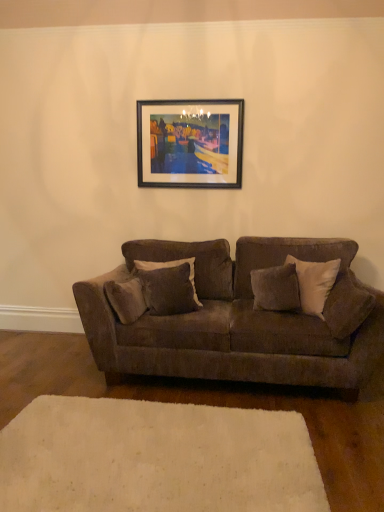
Question: Could white soft rug at lower center be considered to be inside velvet gray pillow at center, which is the third pillow from right to left?

Choices:
 (A) yes
 (B) no

Answer: (B)

Question: Can you confirm if velvet gray pillow at center, which is the third pillow from right to left, is positioned to the right of white soft rug at lower center?

Choices:
 (A) no
 (B) yes

Answer: (B)

Question: Considering the relative sizes of velvet gray pillow at center, the first pillow positioned from the left, and white soft rug at lower center in the image provided, is velvet gray pillow at center, the first pillow positioned from the left, thinner than white soft rug at lower center?

Choices:
 (A) yes
 (B) no

Answer: (A)

Question: Is the position of velvet gray pillow at center, the first pillow positioned from the left, more distant than that of white soft rug at lower center?

Choices:
 (A) no
 (B) yes

Answer: (B)

Question: Is velvet gray pillow at center, which is the third pillow from right to left, smaller than white soft rug at lower center?

Choices:
 (A) no
 (B) yes

Answer: (B)

Question: Is velvet gray pillow at center, which is the third pillow from right to left, closer to camera compared to white soft rug at lower center?

Choices:
 (A) no
 (B) yes

Answer: (A)

Question: Is soft gray fabric pillow at right, which is the first pillow in right-to-left order, wider than velvet brown couch at center?

Choices:
 (A) no
 (B) yes

Answer: (A)

Question: Does soft gray fabric pillow at right, the 3th pillow in the left-to-right sequence, come behind velvet brown couch at center?

Choices:
 (A) yes
 (B) no

Answer: (B)

Question: Is soft gray fabric pillow at right, the 3th pillow in the left-to-right sequence, far away from velvet brown couch at center?

Choices:
 (A) yes
 (B) no

Answer: (B)

Question: Is velvet brown couch at center inside soft gray fabric pillow at right, the 3th pillow in the left-to-right sequence?

Choices:
 (A) no
 (B) yes

Answer: (A)

Question: From the image's perspective, is soft gray fabric pillow at right, which is the first pillow in right-to-left order, beneath velvet brown couch at center?

Choices:
 (A) no
 (B) yes

Answer: (A)

Question: From a real-world perspective, is soft gray fabric pillow at right, the 3th pillow in the left-to-right sequence, physically above velvet brown couch at center?

Choices:
 (A) no
 (B) yes

Answer: (B)

Question: Does velvet gray pillow at center, which is the third pillow from right to left, turn towards velvety brown pillow at center, the 2th pillow when ordered from right to left?

Choices:
 (A) yes
 (B) no

Answer: (B)